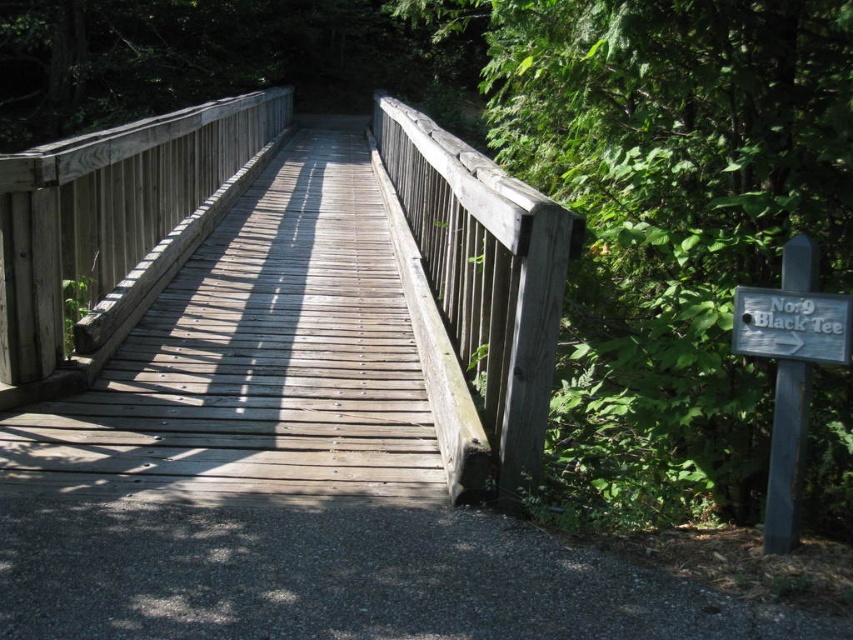
Question: Can you confirm if wooden bridge at center is wider than white wooden sign at right?

Choices:
 (A) yes
 (B) no

Answer: (A)

Question: Which point appears closest to the camera in this image?

Choices:
 (A) (770, 349)
 (B) (505, 307)

Answer: (A)

Question: Which point is farther to the camera?

Choices:
 (A) (775, 291)
 (B) (103, 196)

Answer: (B)

Question: Can you confirm if wooden bridge at center is positioned to the left of white wooden sign at right?

Choices:
 (A) yes
 (B) no

Answer: (A)

Question: Among these points, which one is nearest to the camera?

Choices:
 (A) (775, 337)
 (B) (209, 168)

Answer: (A)

Question: Is wooden bridge at center thinner than white wooden sign at right?

Choices:
 (A) yes
 (B) no

Answer: (B)